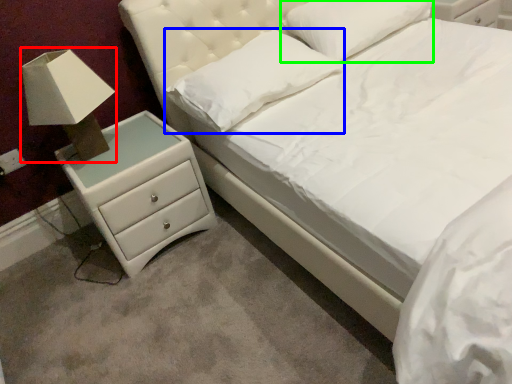
Question: Based on their relative distances, which object is farther from table lamp (highlighted by a red box)? Choose from pillow (highlighted by a blue box) and pillow (highlighted by a green box).

Choices:
 (A) pillow
 (B) pillow

Answer: (B)